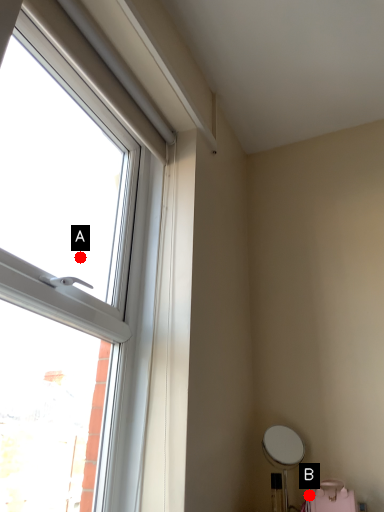
Question: Two points are circled on the image, labeled by A and B beside each circle. Which point is closer to the camera?

Choices:
 (A) A is closer
 (B) B is closer

Answer: (A)